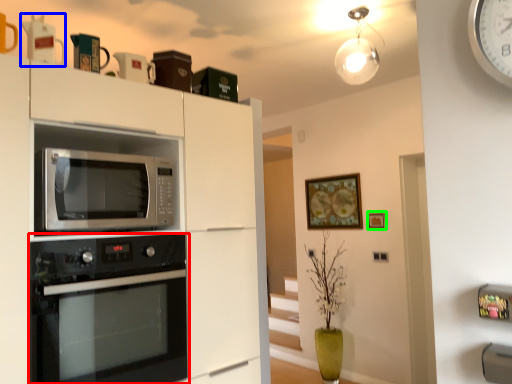
Question: Which object is positioned closest to oven (highlighted by a red box)? Select from appliance (highlighted by a blue box) and picture frame (highlighted by a green box).

Choices:
 (A) appliance
 (B) picture frame

Answer: (A)